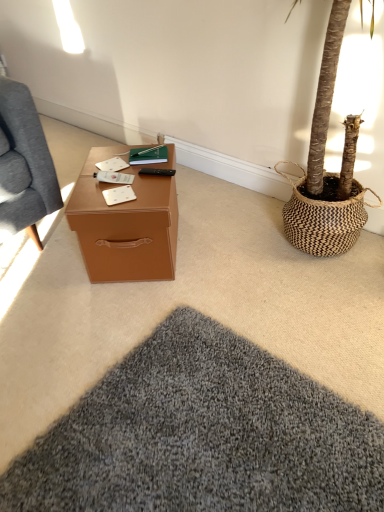
Where is `free space behind black matte remote control at center`? The width and height of the screenshot is (384, 512). free space behind black matte remote control at center is located at coordinates (144, 158).